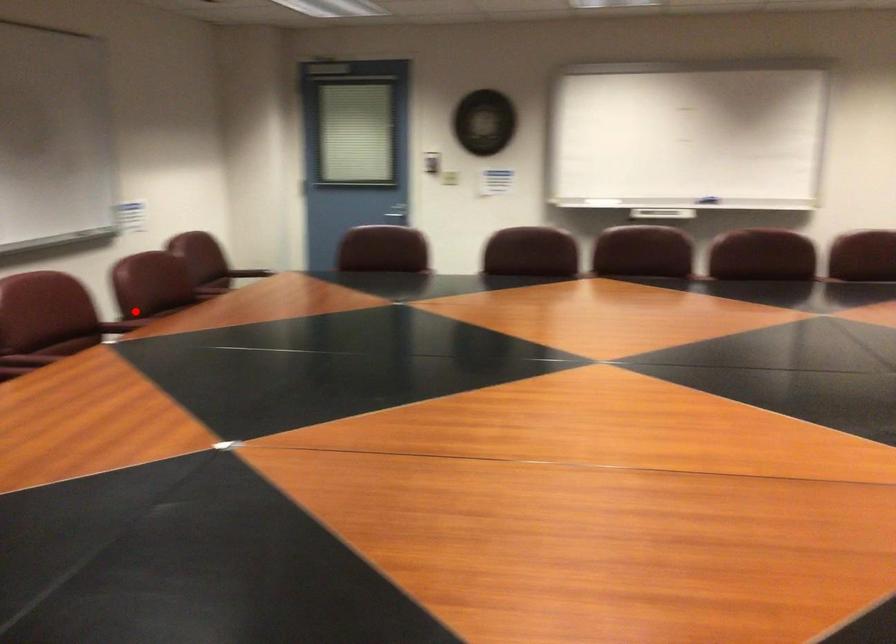
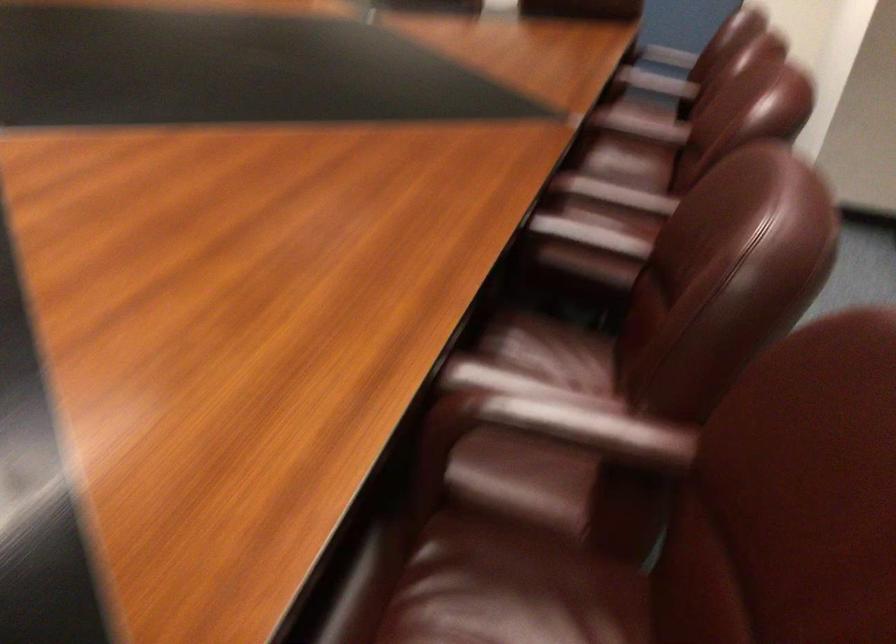
The point at the highlighted location is marked in the first image. Where is the corresponding point in the second image?

(613, 194)